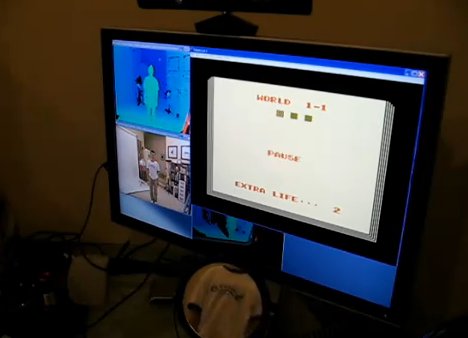
The image size is (468, 338). In order to click on black wires in this screenshot , I will do `click(91, 211)`, `click(130, 295)`.